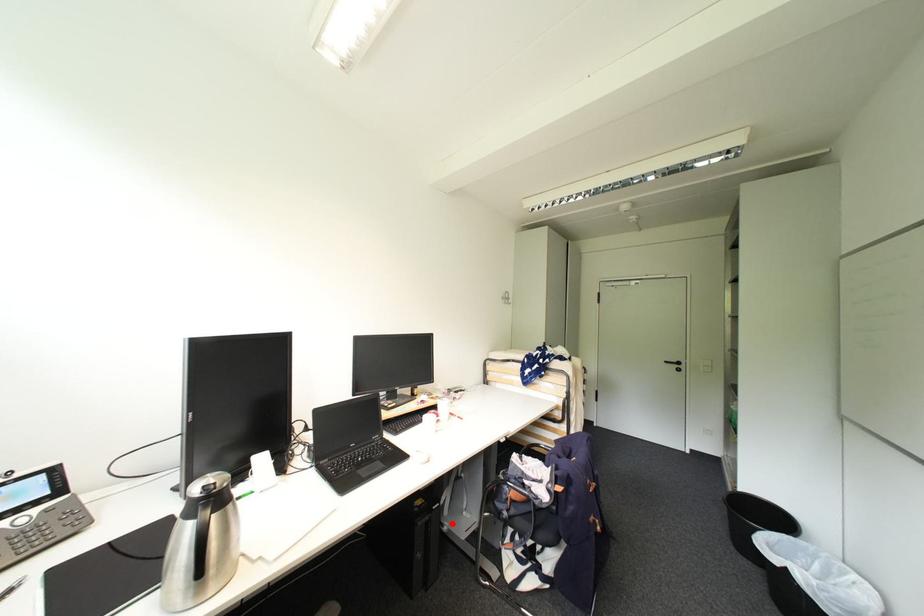
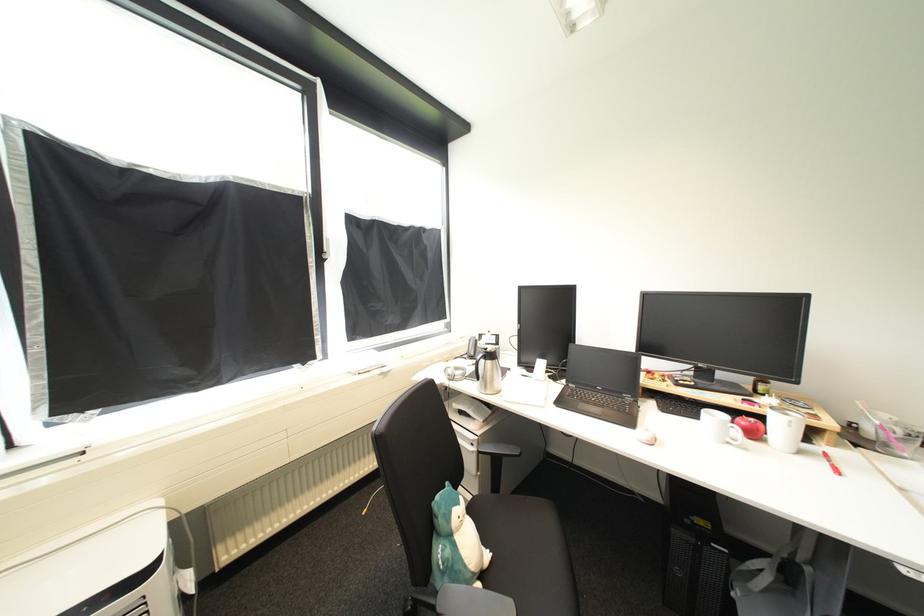
Question: I am providing you with two images of the same scene from different viewpoints. A red point is marked on the first image. Can you still see the location of the red point in image 2?

Choices:
 (A) Yes
 (B) No

Answer: (A)